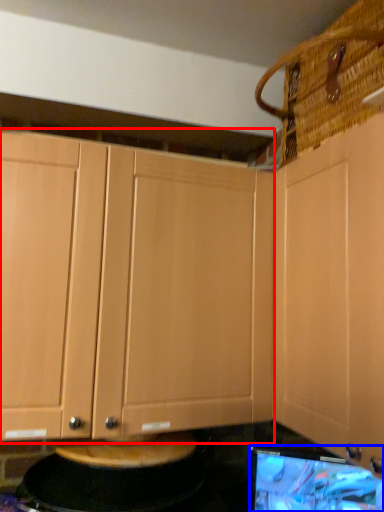
Question: Which object is closer to the camera taking this photo, cabinetry (highlighted by a red box) or computer monitor (highlighted by a blue box)?

Choices:
 (A) cabinetry
 (B) computer monitor

Answer: (B)